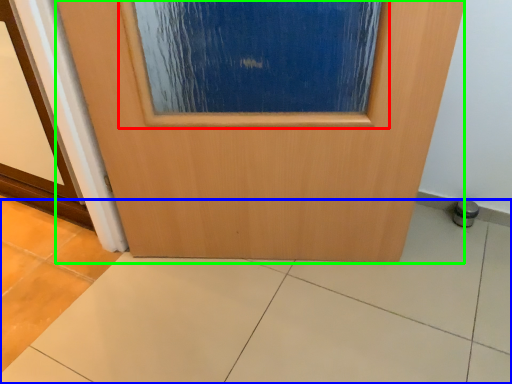
Question: Which is farther away from airplane window (highlighted by a red box)? ceramic tile (highlighted by a blue box) or door (highlighted by a green box)?

Choices:
 (A) ceramic tile
 (B) door

Answer: (A)